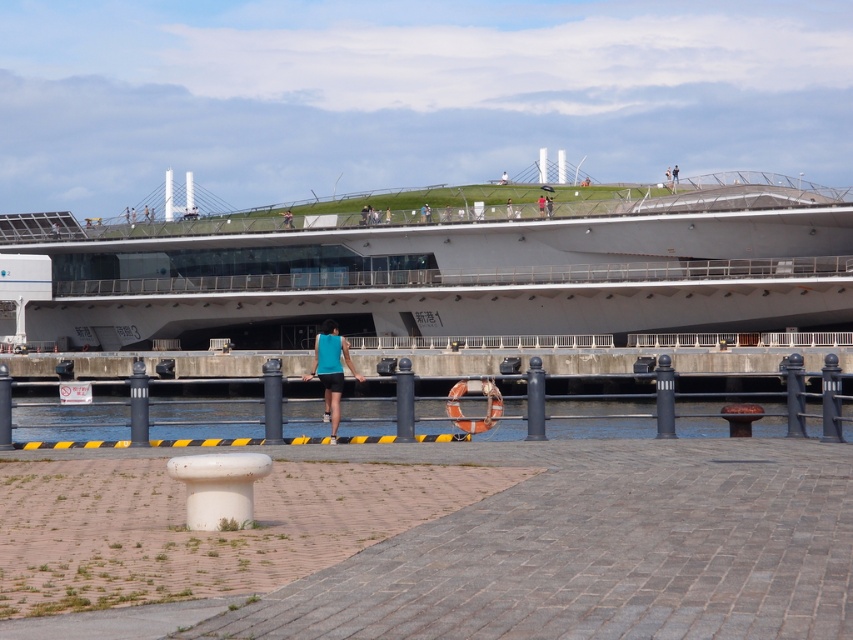
Can you confirm if white glossy cruise ship at upper center is positioned above teal fabric tank top at center?

Correct, white glossy cruise ship at upper center is located above teal fabric tank top at center.

Can you confirm if white glossy cruise ship at upper center is shorter than teal fabric tank top at center?

No.

Is point (254, 216) farther from camera compared to point (337, 381)?

Yes, it is.

This screenshot has width=853, height=640. I want to click on white glossy cruise ship at upper center, so click(442, 269).

Who is positioned more to the left, clear water at dock center or teal fabric tank top at center?

teal fabric tank top at center is more to the left.

Between clear water at dock center and teal fabric tank top at center, which one has more height?

clear water at dock center

Between point (505, 401) and point (303, 380), which one is positioned behind?

The point (303, 380) is behind.

Locate an element on the screen. clear water at dock center is located at coordinates (71, 422).

Is point (782, 196) positioned in front of point (318, 426)?

No.

Measure the distance between white glossy cruise ship at upper center and clear water at dock center.

The distance of white glossy cruise ship at upper center from clear water at dock center is 128.04 feet.

Where is `white glossy cruise ship at upper center`? The width and height of the screenshot is (853, 640). white glossy cruise ship at upper center is located at coordinates (442, 269).